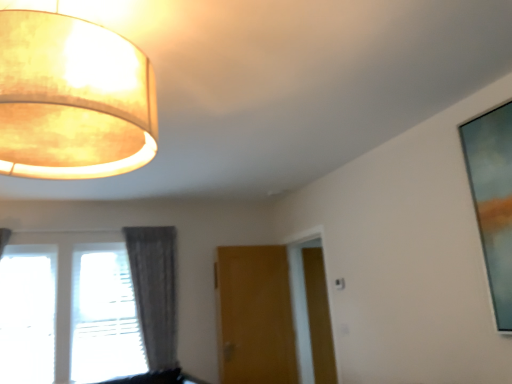
The height and width of the screenshot is (384, 512). Find the location of `wooden door at center`. wooden door at center is located at coordinates (254, 316).

This screenshot has height=384, width=512. What do you see at coordinates (493, 200) in the screenshot? I see `glassy blue painting at upper right` at bounding box center [493, 200].

Locate an element on the screen. Image resolution: width=512 pixels, height=384 pixels. transparent glass window at lower left is located at coordinates (84, 309).

The width and height of the screenshot is (512, 384). In order to click on brown wood screen door at center in this screenshot , I will do `click(319, 316)`.

Measure the distance between point (136, 285) and camera.

Point (136, 285) and camera are 4.27 meters apart.

Find the location of `gray fabric curtain at lower left`. gray fabric curtain at lower left is located at coordinates (155, 291).

At what (x,y) coordinates should I click in order to perform the action: click on wooden door at center. Please return your answer as a coordinate pair (x, y). The width and height of the screenshot is (512, 384). Looking at the image, I should click on (254, 316).

Can you confirm if brown wood screen door at center is smaller than transparent glass window at lower left?

Yes, brown wood screen door at center is smaller than transparent glass window at lower left.

How many degrees apart are the facing directions of brown wood screen door at center and transparent glass window at lower left?

brown wood screen door at center and transparent glass window at lower left are facing 1.18 degrees away from each other.

From the image's perspective, relative to transparent glass window at lower left, is brown wood screen door at center above or below?

brown wood screen door at center is below transparent glass window at lower left.

Is brown wood screen door at center turned away from transparent glass window at lower left?

No, transparent glass window at lower left is not at the back of brown wood screen door at center.

The height and width of the screenshot is (384, 512). Identify the location of door below the matte beige lampshade at upper left (from a real-world perspective). (254, 316).

Based on the photo, which is more to the left, wooden door at center or matte beige lampshade at upper left?

From the viewer's perspective, matte beige lampshade at upper left appears more on the left side.

From the image's perspective, which one is positioned higher, wooden door at center or matte beige lampshade at upper left?

matte beige lampshade at upper left.

Is wooden door at center not within matte beige lampshade at upper left?

Absolutely, wooden door at center is external to matte beige lampshade at upper left.

Which is in front, point (308, 257) or point (50, 101)?

The point (50, 101) is more forward.

From the image's perspective, which is above, brown wood screen door at center or matte beige lampshade at upper left?

matte beige lampshade at upper left is shown above in the image.

Considering their positions, is brown wood screen door at center located in front of or behind matte beige lampshade at upper left?

Clearly, brown wood screen door at center is behind matte beige lampshade at upper left.

Considering the sizes of objects wooden door at center and glassy blue painting at upper right in the image provided, who is bigger, wooden door at center or glassy blue painting at upper right?

wooden door at center is bigger.

Could you tell me if wooden door at center is turned towards glassy blue painting at upper right?

Yes, wooden door at center is aimed at glassy blue painting at upper right.

Would you consider wooden door at center to be distant from glassy blue painting at upper right?

Yes.

From a real-world perspective, is wooden door at center physically located above or below glassy blue painting at upper right?

Clearly, from a real-world perspective, wooden door at center is below glassy blue painting at upper right.

Considering the sizes of objects brown wood screen door at center and glassy blue painting at upper right in the image provided, who is thinner, brown wood screen door at center or glassy blue painting at upper right?

glassy blue painting at upper right is thinner.

Which object is further away from the camera, brown wood screen door at center or glassy blue painting at upper right?

brown wood screen door at center is more distant.

In terms of size, does brown wood screen door at center appear bigger or smaller than glassy blue painting at upper right?

Considering their sizes, brown wood screen door at center takes up more space than glassy blue painting at upper right.

Is point (326, 355) farther from viewer compared to point (487, 274)?

Yes, it is.

From the image's perspective, is transparent glass window at lower left over brown wood screen door at center?

Yes, from the image's perspective, transparent glass window at lower left is above brown wood screen door at center.

How much distance is there between transparent glass window at lower left and brown wood screen door at center?

7.18 feet.

Looking at the image, does transparent glass window at lower left seem bigger or smaller compared to brown wood screen door at center?

Clearly, transparent glass window at lower left is larger in size than brown wood screen door at center.

In the image, is transparent glass window at lower left on the left side or the right side of brown wood screen door at center?

From the image, it's evident that transparent glass window at lower left is to the left of brown wood screen door at center.

Is gray fabric curtain at lower left aimed at wooden door at center?

No, gray fabric curtain at lower left is not oriented towards wooden door at center.

This screenshot has width=512, height=384. Identify the location of door that appears below the gray fabric curtain at lower left (from a real-world perspective). (x=254, y=316).

How different are the orientations of gray fabric curtain at lower left and wooden door at center in degrees?

The angular difference between gray fabric curtain at lower left and wooden door at center is 4.52 degrees.

Between gray fabric curtain at lower left and wooden door at center, which one is positioned behind?

wooden door at center.

The height and width of the screenshot is (384, 512). Find the location of `screen door that appears behind the transparent glass window at lower left`. screen door that appears behind the transparent glass window at lower left is located at coordinates 319,316.

Where is `lamp that is above the wooden door at center (from the image's perspective)`? The image size is (512, 384). lamp that is above the wooden door at center (from the image's perspective) is located at coordinates (72, 99).

From the image, which object appears to be nearer to matte beige lampshade at upper left, gray fabric curtain at lower left or wooden door at center?

gray fabric curtain at lower left lies closer to matte beige lampshade at upper left than the other object.

From the image, which object appears to be nearer to glassy blue painting at upper right, gray fabric curtain at lower left or matte beige lampshade at upper left?

matte beige lampshade at upper left is closer to glassy blue painting at upper right.

Which object lies further to the anchor point gray fabric curtain at lower left, brown wood screen door at center or glassy blue painting at upper right?

glassy blue painting at upper right.

Considering their positions, is gray fabric curtain at lower left positioned further to matte beige lampshade at upper left than transparent glass window at lower left?

Based on the image, gray fabric curtain at lower left appears to be further to matte beige lampshade at upper left.

Looking at the image, which one is located further to matte beige lampshade at upper left, wooden door at center or gray fabric curtain at lower left?

wooden door at center lies further to matte beige lampshade at upper left than the other object.

Which object lies further to the anchor point brown wood screen door at center, gray fabric curtain at lower left or matte beige lampshade at upper left?

matte beige lampshade at upper left is positioned further to the anchor brown wood screen door at center.

Which object lies nearer to the anchor point wooden door at center, brown wood screen door at center or glassy blue painting at upper right?

brown wood screen door at center is positioned closer to the anchor wooden door at center.

In the scene shown: Based on their spatial positions, is matte beige lampshade at upper left or brown wood screen door at center further from transparent glass window at lower left?

Among the two, matte beige lampshade at upper left is located further to transparent glass window at lower left.

Identify the location of window positioned between matte beige lampshade at upper left and brown wood screen door at center from near to far. (84, 309).

Find the location of a particular element. The width and height of the screenshot is (512, 384). door between gray fabric curtain at lower left and glassy blue painting at upper right is located at coordinates (254, 316).

Where is `door between glassy blue painting at upper right and brown wood screen door at center in the front-back direction`? The height and width of the screenshot is (384, 512). door between glassy blue painting at upper right and brown wood screen door at center in the front-back direction is located at coordinates click(x=254, y=316).

At what (x,y) coordinates should I click in order to perform the action: click on door between matte beige lampshade at upper left and brown wood screen door at center along the z-axis. Please return your answer as a coordinate pair (x, y). Looking at the image, I should click on (254, 316).